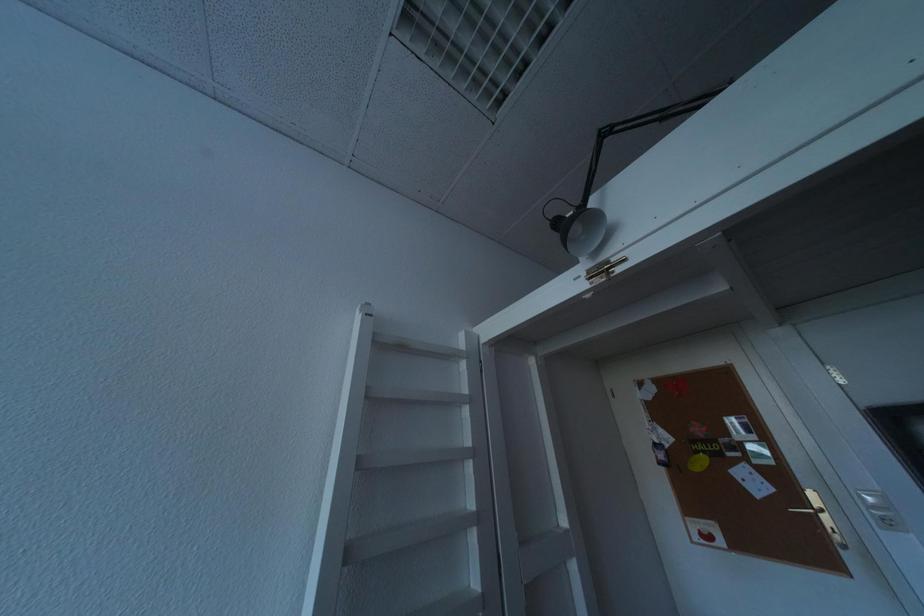
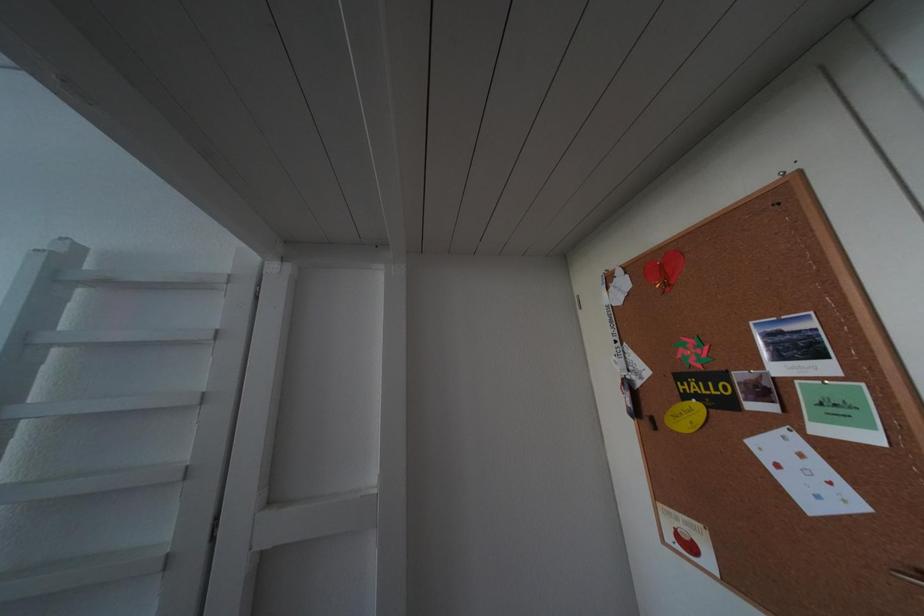
The images are taken continuously from a first-person perspective. In which direction are you moving?

The movement direction of the cameraman is right, forward.